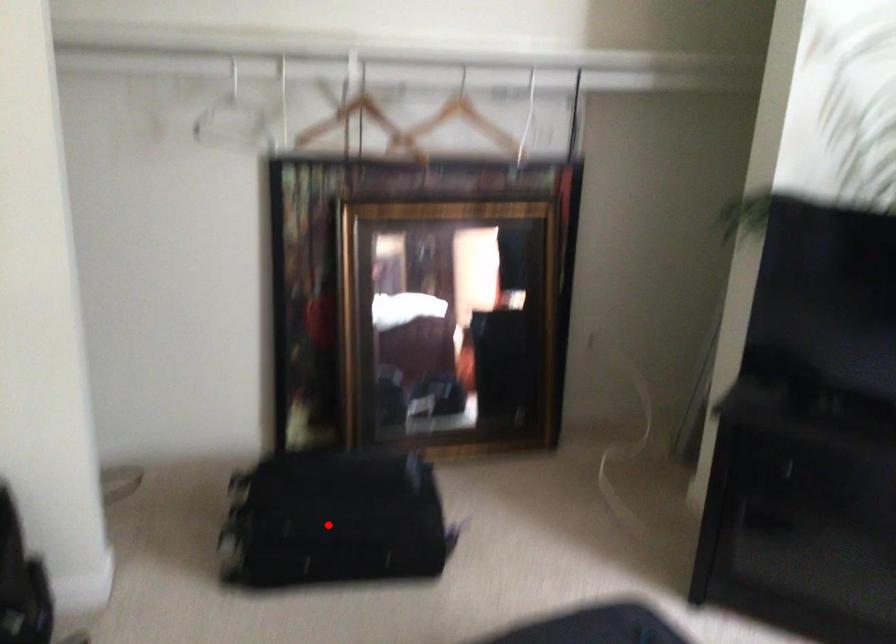
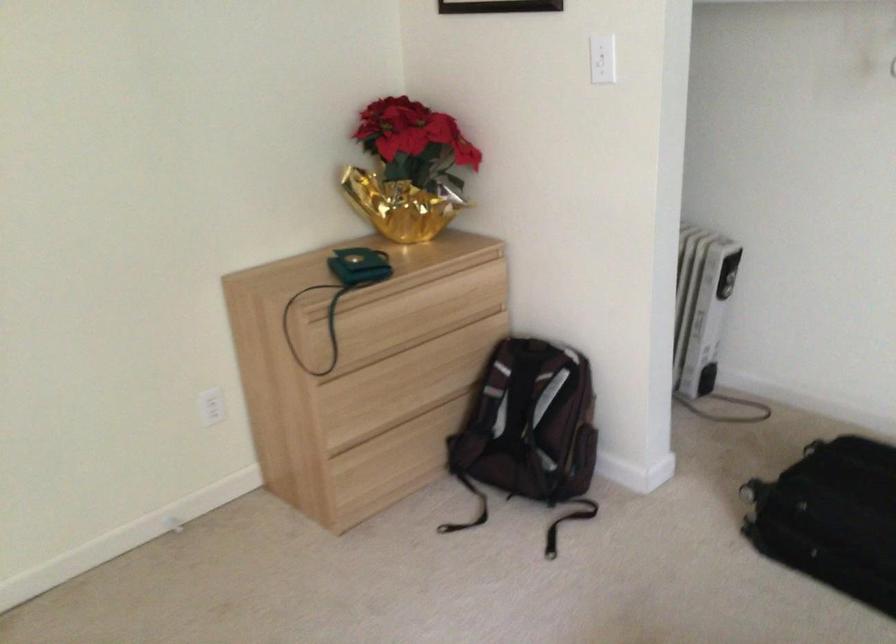
Question: A red point is marked in image1. In image2, is the corresponding 3D point closer to the camera or farther? Reply with the corresponding letter.

Choices:
 (A) The corresponding 3D point is closer.
 (B) The corresponding 3D point is farther.

Answer: (A)